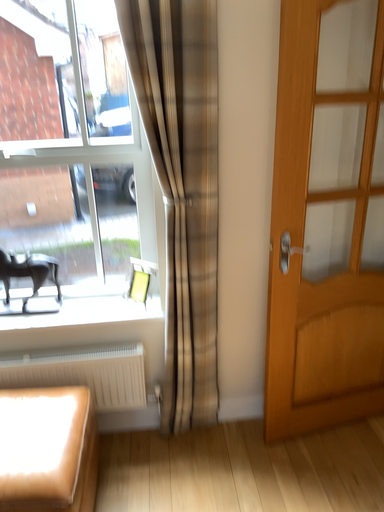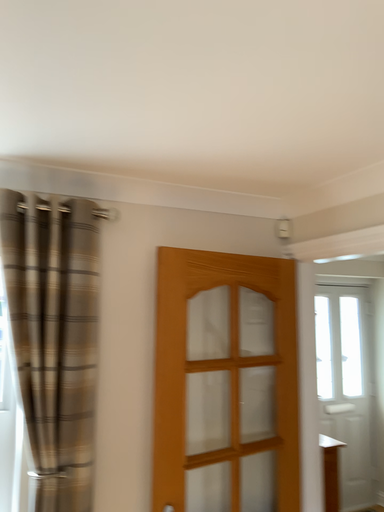
Question: Which way did the camera rotate in the video?

Choices:
 (A) rotated left
 (B) rotated right

Answer: (B)